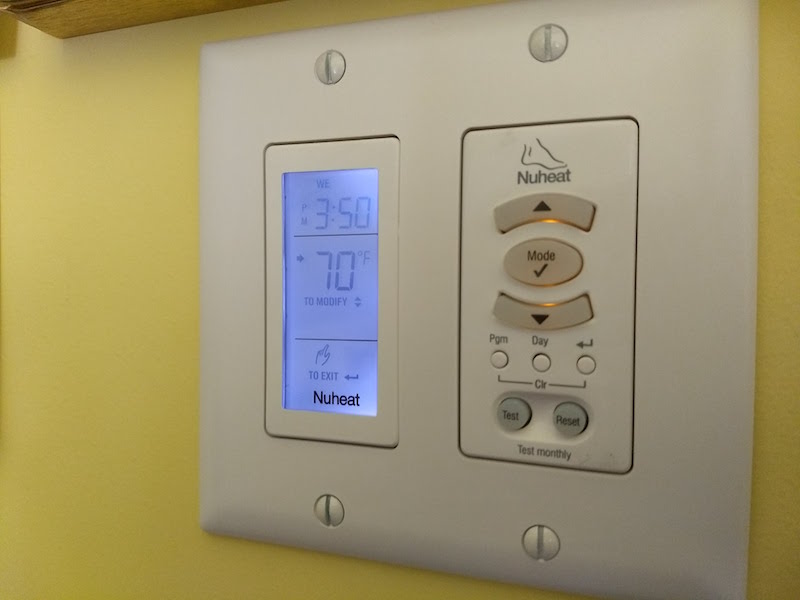
Where is `yellow paint`? Image resolution: width=800 pixels, height=600 pixels. yellow paint is located at coordinates (56, 230).